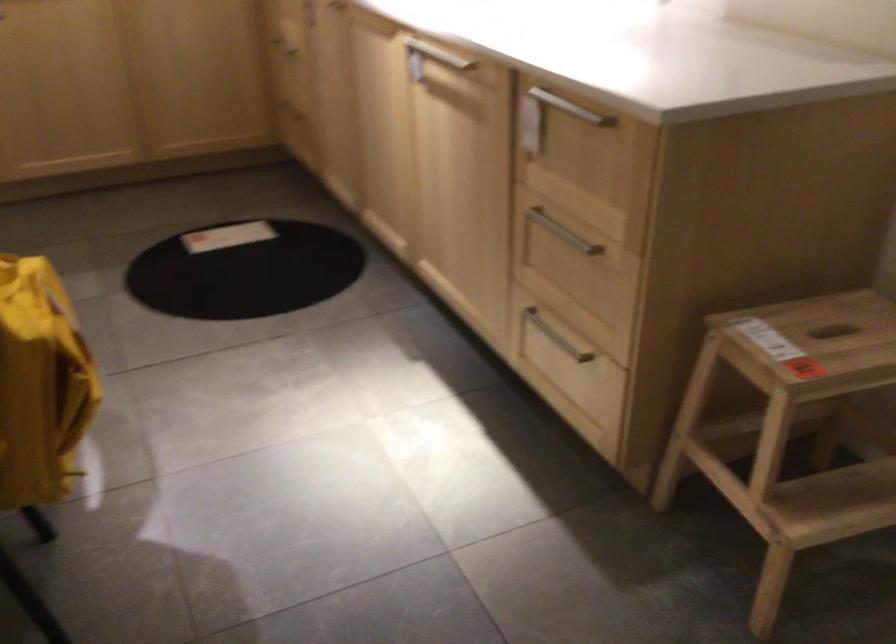
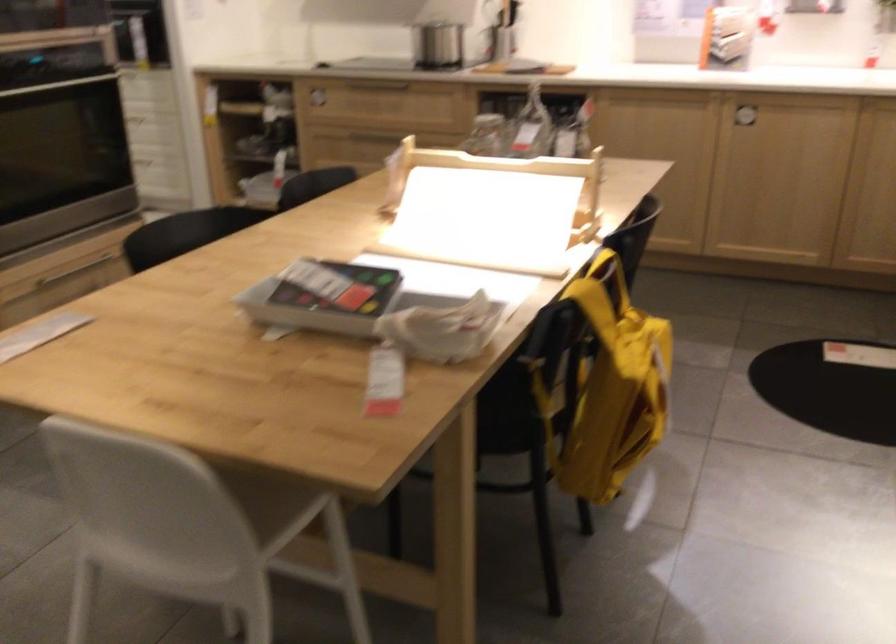
Where in the second image is the point corresponding to pixel 168 348 from the first image?

(760, 419)